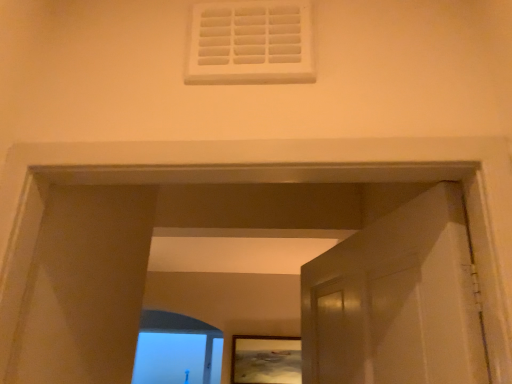
Question: Is clear glass window frame at lower left inside or outside of matte wooden picture frame at center?

Choices:
 (A) inside
 (B) outside

Answer: (B)

Question: From a real-world perspective, is clear glass window frame at lower left above or below matte wooden picture frame at center?

Choices:
 (A) below
 (B) above

Answer: (A)

Question: Based on their sizes in the image, would you say clear glass window frame at lower left is bigger or smaller than matte wooden picture frame at center?

Choices:
 (A) small
 (B) big

Answer: (B)

Question: Is matte wooden picture frame at center wider or thinner than clear glass window frame at lower left?

Choices:
 (A) thin
 (B) wide

Answer: (A)

Question: Is point (275, 357) positioned closer to the camera than point (179, 342)?

Choices:
 (A) closer
 (B) farther

Answer: (A)

Question: Is matte wooden picture frame at center to the left or to the right of clear glass window frame at lower left in the image?

Choices:
 (A) left
 (B) right

Answer: (B)

Question: From a real-world perspective, is matte wooden picture frame at center physically located above or below clear glass window frame at lower left?

Choices:
 (A) above
 (B) below

Answer: (A)